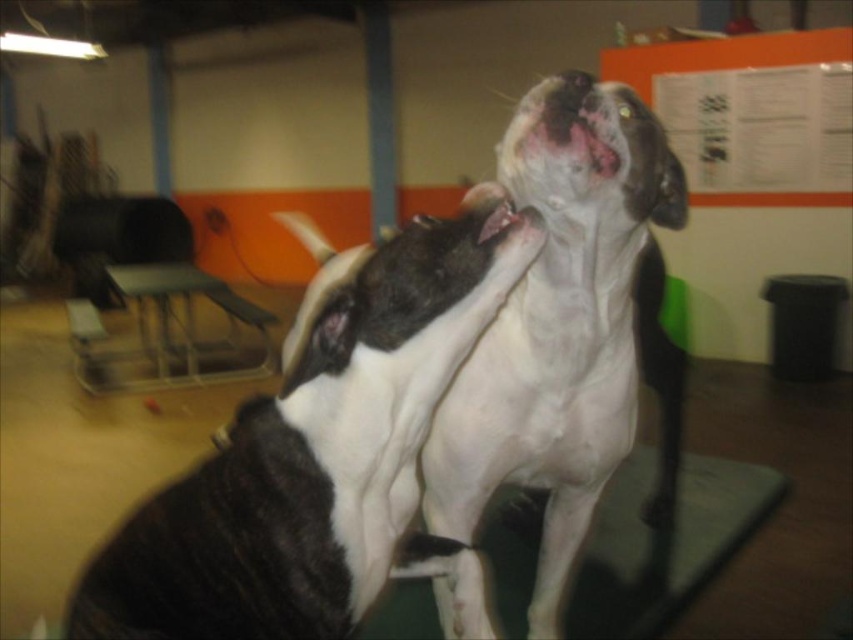
You are a vet technician needing to place a restraint vest on the dogs. The vest is designed for dogs with a minimum width of 40 cm. Given the black and white fur dog at center and the white smooth dog at center, which dog is more likely to require a larger vest size?

The black and white fur dog at center has a greater width than the white smooth dog at center, so it is more likely to require a larger vest size.

In the scene shown: You are a photographer trying to capture both the white smooth dog at center and the white glossy mouth at upper center in a single shot. Since the camera can only focus on one subject at a time, which subject should you prioritize focusing on to ensure the other is still in the frame?

The white smooth dog at center is positioned on the right side of white glossy mouth at upper center, so focusing on the white glossy mouth at upper center would keep the white smooth dog at center within the frame as well.

You are a veterinary assistant who needs to place a small medical kit on the table near the white smooth dog at center. The table is located at point coordinates of (566, 330). Can you confirm if the white smooth dog at center is positioned at that exact point?

Yes, the white smooth dog at center is located exactly at point coordinates (566, 330), so placing the medical kit there would position it near the dog.